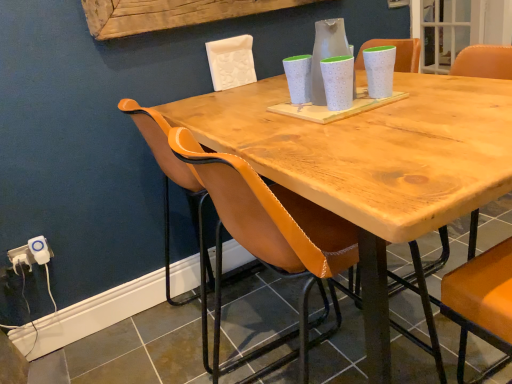
The image size is (512, 384). What do you see at coordinates (31, 253) in the screenshot?
I see `white plastic electric outlet at lower left, positioned as the 1th electric outlet in left-to-right order` at bounding box center [31, 253].

This screenshot has width=512, height=384. Find the location of `white plastic electric outlet at lower left, which is counted as the 2th electric outlet, starting from the left`. white plastic electric outlet at lower left, which is counted as the 2th electric outlet, starting from the left is located at coordinates (40, 250).

What do you see at coordinates (40, 250) in the screenshot?
I see `white plastic electric outlet at lower left, which is counted as the 2th electric outlet, starting from the left` at bounding box center [40, 250].

The height and width of the screenshot is (384, 512). What are the coordinates of `white plastic electric outlet at lower left, the 2th electric outlet from the right` in the screenshot? It's located at (31, 253).

Which is more to the left, leather at left or white dotted vase at center?

Positioned to the left is leather at left.

Is leather at left beside white dotted vase at center?

No, leather at left is not in contact with white dotted vase at center.

Which object is wider, leather at left or white dotted vase at center?

leather at left is wider.

Could white plastic electric outlet at lower left, the 2th electric outlet from the right, be considered to be inside leather at left?

No.

Does point (395, 294) appear closer or farther from the camera than point (14, 253)?

Point (395, 294).

Can you tell me how much leather at left and white plastic electric outlet at lower left, positioned as the 1th electric outlet in left-to-right order, differ in facing direction?

They differ by 90.6 degrees in their facing directions.

Which of these two, leather at left or white plastic electric outlet at lower left, positioned as the 1th electric outlet in left-to-right order, stands shorter?

Standing shorter between the two is white plastic electric outlet at lower left, positioned as the 1th electric outlet in left-to-right order.

Where is `electric outlet above the white plastic electric outlet at lower left, the 2th electric outlet from the right (from the image's perspective)`? electric outlet above the white plastic electric outlet at lower left, the 2th electric outlet from the right (from the image's perspective) is located at coordinates (40, 250).

Is white plastic electric outlet at lower left, which appears as the first electric outlet when viewed from the right, taller or shorter than white plastic electric outlet at lower left, the 2th electric outlet from the right?

Considering their sizes, white plastic electric outlet at lower left, which appears as the first electric outlet when viewed from the right, has more height than white plastic electric outlet at lower left, the 2th electric outlet from the right.

Can you confirm if white plastic electric outlet at lower left, which appears as the first electric outlet when viewed from the right, is positioned to the right of white plastic electric outlet at lower left, the 2th electric outlet from the right?

Indeed, white plastic electric outlet at lower left, which appears as the first electric outlet when viewed from the right, is positioned on the right side of white plastic electric outlet at lower left, the 2th electric outlet from the right.

Considering the sizes of objects white plastic electric outlet at lower left, which appears as the first electric outlet when viewed from the right, and white plastic electric outlet at lower left, the 2th electric outlet from the right, in the image provided, who is wider, white plastic electric outlet at lower left, which appears as the first electric outlet when viewed from the right, or white plastic electric outlet at lower left, the 2th electric outlet from the right,?

Wider between the two is white plastic electric outlet at lower left, which appears as the first electric outlet when viewed from the right.

From a real-world perspective, which object rests below the other?

leather at left.

Can you confirm if white dotted vase at center is smaller than leather at left?

Indeed, white dotted vase at center has a smaller size compared to leather at left.

From the image's perspective, which one is positioned lower, white dotted vase at center or leather at left?

From the image's view, leather at left is below.

Is white plastic electric outlet at lower left, which appears as the first electric outlet when viewed from the right, facing away from leather at left?

No, leather at left is not at the back of white plastic electric outlet at lower left, which appears as the first electric outlet when viewed from the right.

Considering the relative positions of white plastic electric outlet at lower left, which appears as the first electric outlet when viewed from the right, and leather at left in the image provided, is white plastic electric outlet at lower left, which appears as the first electric outlet when viewed from the right, to the right of leather at left from the viewer's perspective?

Incorrect, white plastic electric outlet at lower left, which appears as the first electric outlet when viewed from the right, is not on the right side of leather at left.

Can you confirm if white plastic electric outlet at lower left, which appears as the first electric outlet when viewed from the right, is smaller than leather at left?

Yes.

Would you consider white plastic electric outlet at lower left, which is counted as the 2th electric outlet, starting from the left, to be distant from leather at left?

No, white plastic electric outlet at lower left, which is counted as the 2th electric outlet, starting from the left, is not far from leather at left.

Between white dotted vase at center and white plastic electric outlet at lower left, which appears as the first electric outlet when viewed from the right, which one appears on the left side from the viewer's perspective?

Positioned to the left is white plastic electric outlet at lower left, which appears as the first electric outlet when viewed from the right.

Is white dotted vase at center looking in the opposite direction of white plastic electric outlet at lower left, which is counted as the 2th electric outlet, starting from the left?

white dotted vase at center is not turned away from white plastic electric outlet at lower left, which is counted as the 2th electric outlet, starting from the left.

Considering the sizes of objects white dotted vase at center and white plastic electric outlet at lower left, which is counted as the 2th electric outlet, starting from the left, in the image provided, who is taller, white dotted vase at center or white plastic electric outlet at lower left, which is counted as the 2th electric outlet, starting from the left,?

Standing taller between the two is white dotted vase at center.

Are white dotted vase at center and white plastic electric outlet at lower left, which appears as the first electric outlet when viewed from the right, located far from each other?

Yes, white dotted vase at center and white plastic electric outlet at lower left, which appears as the first electric outlet when viewed from the right, are located far from each other.

Is white dotted vase at center in front of or behind white plastic electric outlet at lower left, positioned as the 1th electric outlet in left-to-right order, in the image?

white dotted vase at center is in front of white plastic electric outlet at lower left, positioned as the 1th electric outlet in left-to-right order.

From a real-world perspective, is white dotted vase at center on white plastic electric outlet at lower left, positioned as the 1th electric outlet in left-to-right order?

Indeed, from a real-world perspective, white dotted vase at center stands above white plastic electric outlet at lower left, positioned as the 1th electric outlet in left-to-right order.

How different are the orientations of white dotted vase at center and white plastic electric outlet at lower left, positioned as the 1th electric outlet in left-to-right order, in degrees?

The angular difference between white dotted vase at center and white plastic electric outlet at lower left, positioned as the 1th electric outlet in left-to-right order, is 0.714 degrees.

Can you confirm if white dotted vase at center is smaller than white plastic electric outlet at lower left, the 2th electric outlet from the right?

Actually, white dotted vase at center might be larger than white plastic electric outlet at lower left, the 2th electric outlet from the right.

The width and height of the screenshot is (512, 384). In order to click on chair on the left of the white dotted vase at center in this screenshot , I will do `click(168, 201)`.

Image resolution: width=512 pixels, height=384 pixels. Identify the location of chair lying in front of the white plastic electric outlet at lower left, positioned as the 1th electric outlet in left-to-right order. (168, 201).

Which object lies nearer to the anchor point white plastic electric outlet at lower left, positioned as the 1th electric outlet in left-to-right order, white dotted vase at center or white plastic electric outlet at lower left, which is counted as the 2th electric outlet, starting from the left?

white plastic electric outlet at lower left, which is counted as the 2th electric outlet, starting from the left, is closer to white plastic electric outlet at lower left, positioned as the 1th electric outlet in left-to-right order.

From the image, which object appears to be farther from white plastic electric outlet at lower left, which is counted as the 2th electric outlet, starting from the left, white dotted vase at center or white plastic electric outlet at lower left, positioned as the 1th electric outlet in left-to-right order?

Based on the image, white dotted vase at center appears to be further to white plastic electric outlet at lower left, which is counted as the 2th electric outlet, starting from the left.

Estimate the real-world distances between objects in this image. Which object is closer to white plastic electric outlet at lower left, which appears as the first electric outlet when viewed from the right, white dotted vase at center or leather at left?

leather at left lies closer to white plastic electric outlet at lower left, which appears as the first electric outlet when viewed from the right, than the other object.

From the image, which object appears to be farther from white plastic electric outlet at lower left, which is counted as the 2th electric outlet, starting from the left, leather at left or white dotted vase at center?

white dotted vase at center.

Based on their spatial positions, is white plastic electric outlet at lower left, positioned as the 1th electric outlet in left-to-right order, or leather at left closer to white plastic electric outlet at lower left, which is counted as the 2th electric outlet, starting from the left?

Among the two, white plastic electric outlet at lower left, positioned as the 1th electric outlet in left-to-right order, is located nearer to white plastic electric outlet at lower left, which is counted as the 2th electric outlet, starting from the left.

When comparing their distances from white dotted vase at center, does leather at left or white plastic electric outlet at lower left, which appears as the first electric outlet when viewed from the right, seem closer?

Among the two, leather at left is located nearer to white dotted vase at center.

Which object lies nearer to the anchor point leather at left, white plastic electric outlet at lower left, positioned as the 1th electric outlet in left-to-right order, or white dotted vase at center?

white plastic electric outlet at lower left, positioned as the 1th electric outlet in left-to-right order, is positioned closer to the anchor leather at left.

When comparing their distances from leather at left, does white plastic electric outlet at lower left, which is counted as the 2th electric outlet, starting from the left, or white dotted vase at center seem closer?

The object closer to leather at left is white plastic electric outlet at lower left, which is counted as the 2th electric outlet, starting from the left.

Locate an element on the screen. chair between white plastic electric outlet at lower left, which appears as the first electric outlet when viewed from the right, and white dotted vase at center from left to right is located at coordinates (168, 201).

Locate an element on the screen. This screenshot has height=384, width=512. electric outlet between white plastic electric outlet at lower left, positioned as the 1th electric outlet in left-to-right order, and white dotted vase at center, in the horizontal direction is located at coordinates (40, 250).

I want to click on chair situated between white plastic electric outlet at lower left, positioned as the 1th electric outlet in left-to-right order, and white dotted vase at center from left to right, so pyautogui.click(x=168, y=201).

Locate an element on the screen. electric outlet between white plastic electric outlet at lower left, positioned as the 1th electric outlet in left-to-right order, and leather at left is located at coordinates (40, 250).